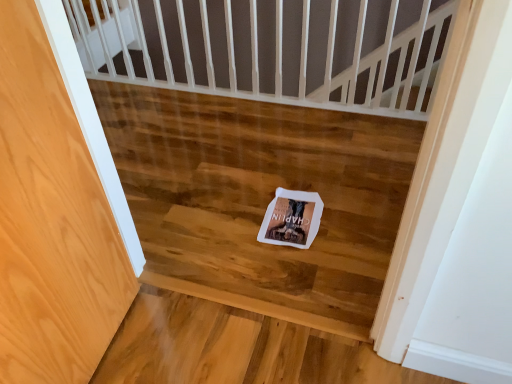
Locate an element on the screen. The width and height of the screenshot is (512, 384). free space below wooden floor at center (from a real-world perspective) is located at coordinates (248, 175).